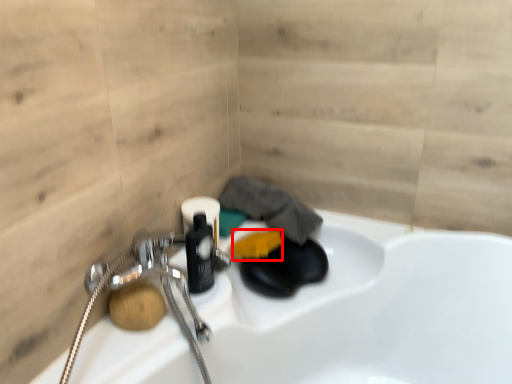
Question: From the image's perspective, what is the correct spatial relationship of soap (annotated by the red box) in relation to soap?

Choices:
 (A) below
 (B) above

Answer: (B)